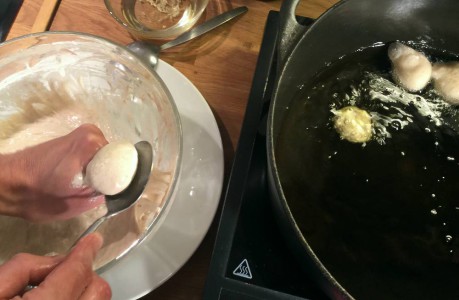
Locate an element on the screen. glass bowl is located at coordinates pyautogui.click(x=66, y=63).